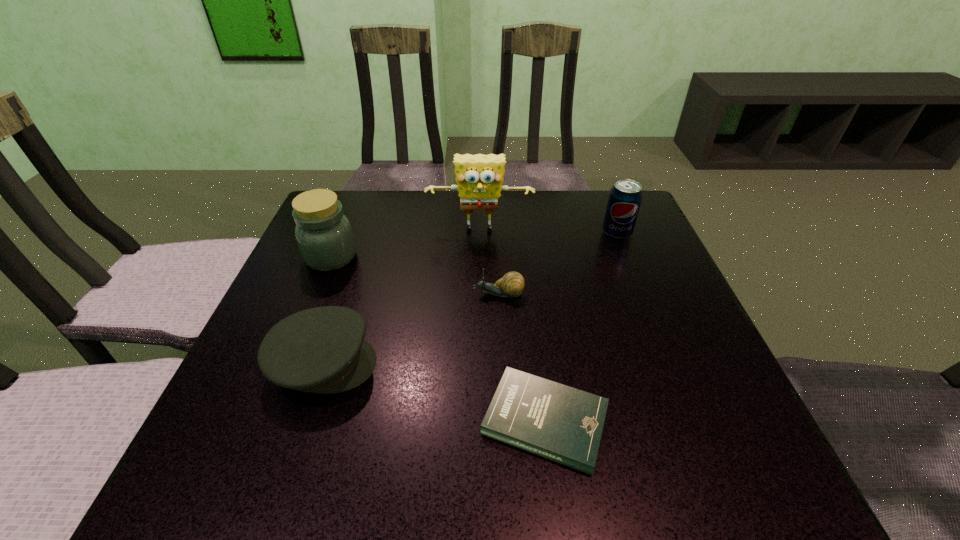
Find the location of `vacant region located 0.380m on the left of the soda can`. vacant region located 0.380m on the left of the soda can is located at coordinates (452, 233).

Where is `vacant space situated 0.180m on the front-facing side of the beret`? The height and width of the screenshot is (540, 960). vacant space situated 0.180m on the front-facing side of the beret is located at coordinates (474, 364).

In order to click on vacant area situated 0.130m on the front-facing side of the fifth tallest object in this screenshot , I will do point(413,294).

Find the location of `vacant space located 0.090m on the front-facing side of the fifth tallest object`. vacant space located 0.090m on the front-facing side of the fifth tallest object is located at coordinates (431, 294).

Locate an element on the screen. This screenshot has width=960, height=540. free spot located 0.110m on the front-facing side of the fifth tallest object is located at coordinates (422, 294).

This screenshot has height=540, width=960. In order to click on free space located 0.400m on the back of the shortest object in this screenshot , I will do `click(523, 242)`.

At what (x,y) coordinates should I click in order to perform the action: click on sponge that is at the far edge. Please return your answer as a coordinate pair (x, y). Looking at the image, I should click on (479, 177).

Locate an element on the screen. The image size is (960, 540). soda can that is at the far edge is located at coordinates (625, 197).

Locate an element on the screen. object located in the near edge section of the desktop is located at coordinates click(564, 424).

Find the location of a particular element. The image size is (960, 540). jar located in the left edge section of the desktop is located at coordinates (324, 236).